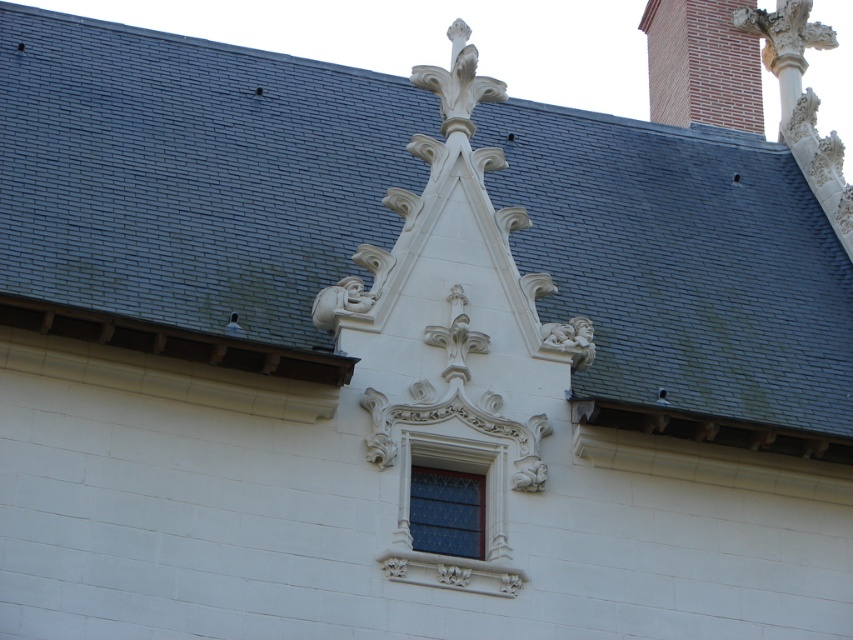
Question: Which object is farther from the camera taking this photo?

Choices:
 (A) red brick chimney at upper right
 (B) stained glass window at center

Answer: (A)

Question: Does red brick chimney at upper right appear on the right side of stained glass window at center?

Choices:
 (A) yes
 (B) no

Answer: (A)

Question: Among these points, which one is farthest from the camera?

Choices:
 (A) (729, 70)
 (B) (432, 470)

Answer: (A)

Question: Can you confirm if red brick chimney at upper right is positioned to the right of stained glass window at center?

Choices:
 (A) no
 (B) yes

Answer: (B)

Question: Is red brick chimney at upper right to the left of stained glass window at center from the viewer's perspective?

Choices:
 (A) no
 (B) yes

Answer: (A)